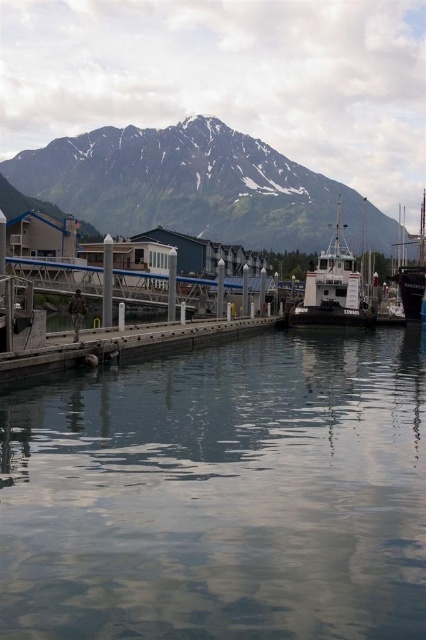
You are standing on the dock and looking towards the center of the image. Which object, the clear water at center or the white matte boat at center, is closer to you?

The clear water at center is closer to the viewer than the white matte boat at center.

You are standing on the dock and want to check the water level relative to the boat. Which object, the clear water at center or the shiny black sailboat at right, is lower in the scene?

The clear water at center is located below the shiny black sailboat at right, so the clear water at center is lower in the scene.

You are a sailor planning to navigate a boat through the harbor. The boat requires a minimum of 1500 feet of clearance between the clear water at center and the snowy granite mountain at upper center to pass safely. Based on the scene, can your boat safely navigate through this area?

The distance between the clear water at center and the snowy granite mountain at upper center is 1525.29 feet, which exceeds the required 1500 feet clearance. Therefore, the boat can safely navigate through the area.